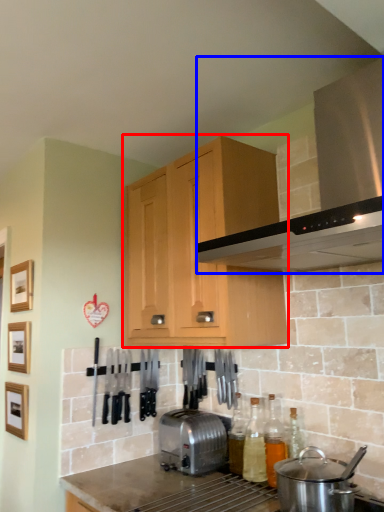
Question: Among these objects, which one is farthest to the camera, cabinetry (highlighted by a red box) or home appliance (highlighted by a blue box)?

Choices:
 (A) cabinetry
 (B) home appliance

Answer: (A)